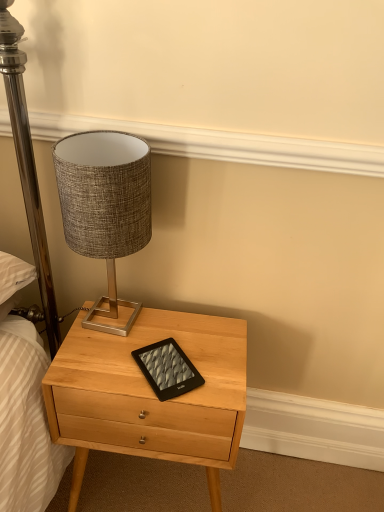
Question: Is light wood nightstand at center to the left or to the right of textured fabric lampshade at upper left in the image?

Choices:
 (A) right
 (B) left

Answer: (A)

Question: From the image's perspective, relative to textured fabric lampshade at upper left, is light wood nightstand at center above or below?

Choices:
 (A) above
 (B) below

Answer: (B)

Question: Estimate the real-world distances between objects in this image. Which object is closer to the textured fabric lampshade at upper left?

Choices:
 (A) black matte tablet at center
 (B) light wood nightstand at center

Answer: (A)

Question: Which object is the farthest from the light wood nightstand at center?

Choices:
 (A) black matte tablet at center
 (B) textured fabric lampshade at upper left

Answer: (B)